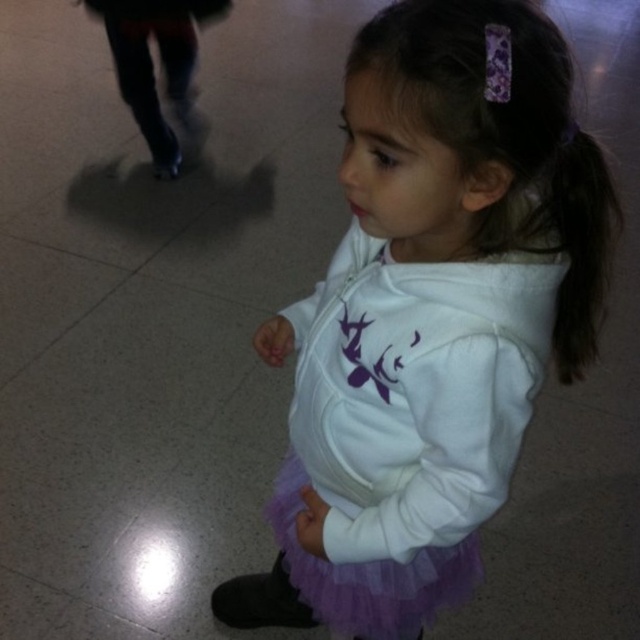
Question: Among these objects, which one is nearest to the camera?

Choices:
 (A) purple tulle ballet skirt at center
 (B) white fleece jacket at center

Answer: (B)

Question: Does white fleece jacket at center appear under purple tulle ballet skirt at center?

Choices:
 (A) yes
 (B) no

Answer: (B)

Question: Is white fleece jacket at center closer to camera compared to purple tulle skirt at center?

Choices:
 (A) no
 (B) yes

Answer: (B)

Question: Based on their relative distances, which object is nearer to the white fleece jacket at center?

Choices:
 (A) purple tulle skirt at center
 (B) purple silky hair at center
 (C) purple tulle ballet skirt at center

Answer: (A)

Question: Does purple tulle skirt at center have a smaller size compared to purple silky hair at center?

Choices:
 (A) no
 (B) yes

Answer: (A)

Question: Which point is farther to the camera?

Choices:
 (A) purple tulle ballet skirt at center
 (B) white fleece jacket at center
 (C) purple silky hair at center

Answer: (A)